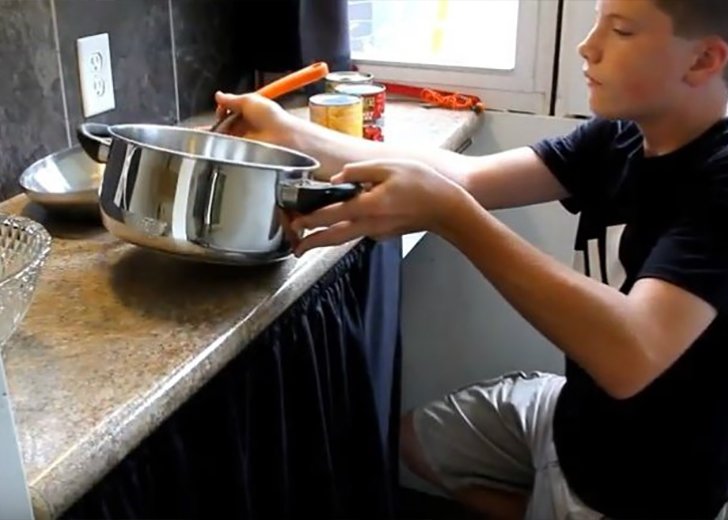
Locate an element on the screen. navy blue curtain is located at coordinates (364, 307).